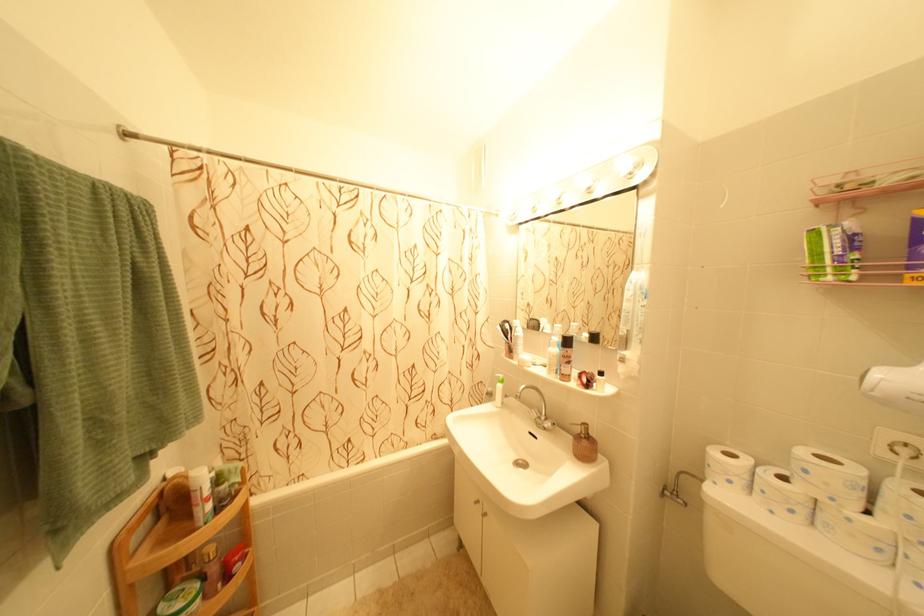
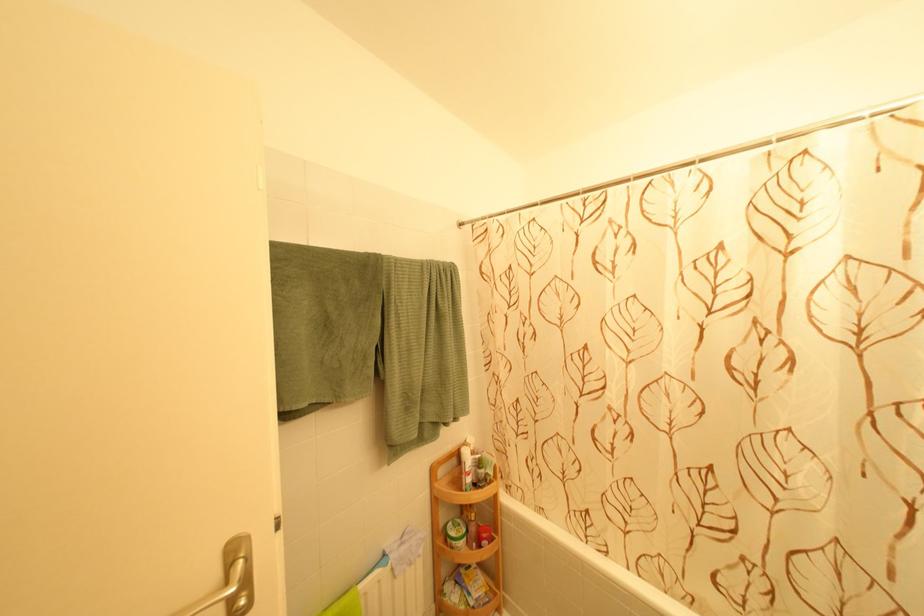
Question: The camera is either moving clockwise (left) or counter-clockwise (right) around the object. The first image is from the beginning of the video and the second image is from the end. Is the camera moving left or right when shooting the video?

Choices:
 (A) Left
 (B) Right

Answer: (B)